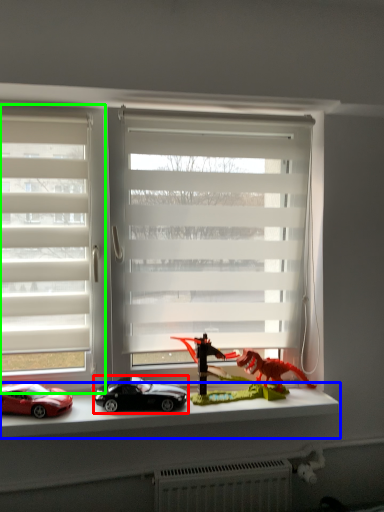
Question: Which object is the closest to the car (highlighted by a red box)? Choose among these: window sill (highlighted by a blue box) or window (highlighted by a green box).

Choices:
 (A) window sill
 (B) window

Answer: (A)